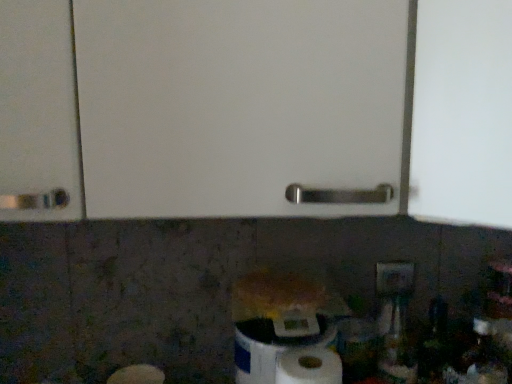
Question: From the image's perspective, would you say white matte paper towel at lower center is shown under white plastic electric outlet at lower right?

Choices:
 (A) yes
 (B) no

Answer: (A)

Question: From a real-world perspective, is white matte paper towel at lower center located higher than white plastic electric outlet at lower right?

Choices:
 (A) yes
 (B) no

Answer: (B)

Question: Is white matte paper towel at lower center at the left side of white plastic electric outlet at lower right?

Choices:
 (A) no
 (B) yes

Answer: (B)

Question: Considering the relative sizes of white matte paper towel at lower center and white plastic electric outlet at lower right in the image provided, is white matte paper towel at lower center thinner than white plastic electric outlet at lower right?

Choices:
 (A) yes
 (B) no

Answer: (B)

Question: Are white matte paper towel at lower center and white plastic electric outlet at lower right far apart?

Choices:
 (A) yes
 (B) no

Answer: (B)

Question: Considering their positions, is white plastic electric outlet at lower right located in front of or behind white matte paper towel at lower center?

Choices:
 (A) behind
 (B) front

Answer: (A)

Question: In terms of width, does white plastic electric outlet at lower right look wider or thinner when compared to white matte paper towel at lower center?

Choices:
 (A) thin
 (B) wide

Answer: (A)

Question: In terms of height, does white plastic electric outlet at lower right look taller or shorter compared to white matte paper towel at lower center?

Choices:
 (A) tall
 (B) short

Answer: (B)

Question: Is point (381, 289) closer or farther from the camera than point (284, 360)?

Choices:
 (A) closer
 (B) farther

Answer: (B)

Question: Considering the positions of white matte paper towel at lower center and white plastic electric outlet at lower right in the image, is white matte paper towel at lower center taller or shorter than white plastic electric outlet at lower right?

Choices:
 (A) tall
 (B) short

Answer: (A)

Question: Considering the positions of point (281, 354) and point (395, 268), is point (281, 354) closer or farther from the camera than point (395, 268)?

Choices:
 (A) closer
 (B) farther

Answer: (A)

Question: Considering their positions, is white matte paper towel at lower center located in front of or behind white plastic electric outlet at lower right?

Choices:
 (A) front
 (B) behind

Answer: (A)

Question: From the image's perspective, is white matte paper towel at lower center located above or below white plastic electric outlet at lower right?

Choices:
 (A) above
 (B) below

Answer: (B)

Question: Based on their sizes in the image, would you say white matte paper towel at lower center is bigger or smaller than white matte toilet paper at lower center?

Choices:
 (A) big
 (B) small

Answer: (B)

Question: From a real-world perspective, is white matte paper towel at lower center above or below white matte toilet paper at lower center?

Choices:
 (A) above
 (B) below

Answer: (B)